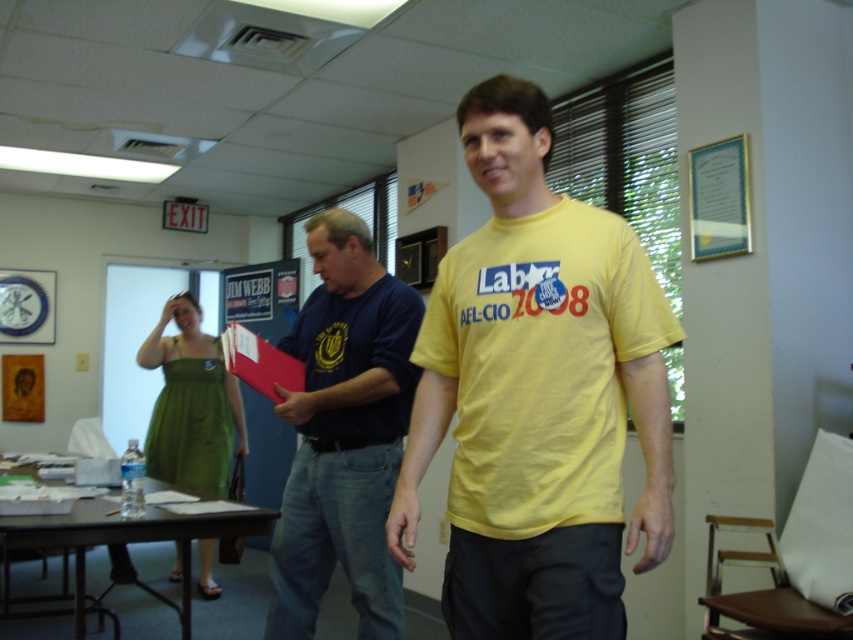
Looking at this image, you are standing in the office scene described. There is a point marked at coordinates (x=537, y=394). What object is located at this point?

The point at coordinates (x=537, y=394) corresponds to the yellow cotton t shirt at center.